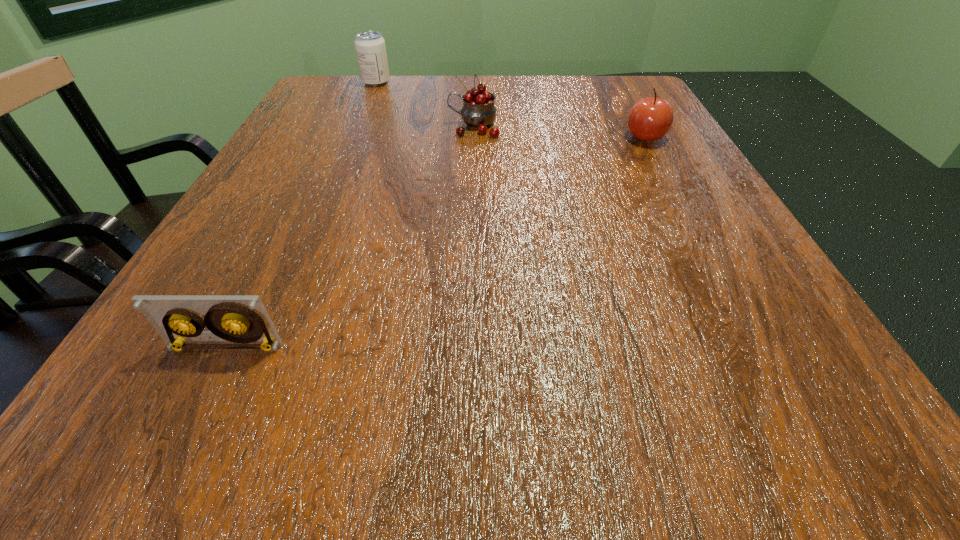
Where is `free spot between the cherry and the apple`? free spot between the cherry and the apple is located at coordinates (560, 132).

Locate an element on the screen. This screenshot has height=540, width=960. free space that is in between the nearest object and the rightmost object is located at coordinates (436, 242).

At what (x,y) coordinates should I click in order to perform the action: click on vacant space that's between the cherry and the soda can. Please return your answer as a coordinate pair (x, y). This screenshot has width=960, height=540. Looking at the image, I should click on (425, 104).

This screenshot has width=960, height=540. Identify the location of vacant area that lies between the videotape and the soda can. (300, 214).

Where is `object that stands as the closest to the apple`? The image size is (960, 540). object that stands as the closest to the apple is located at coordinates (478, 111).

Identify which object is located as the nearest to the cherry. Please provide its 2D coordinates. Your answer should be formatted as a tuple, i.e. [(x, y)], where the tuple contains the x and y coordinates of a point satisfying the conditions above.

[(370, 47)]

Where is `vacant region that satisfies the following two spatial constraints: 1. on the handle side of the third object from left to right; 2. on the front side of the soda can`? This screenshot has width=960, height=540. vacant region that satisfies the following two spatial constraints: 1. on the handle side of the third object from left to right; 2. on the front side of the soda can is located at coordinates (474, 82).